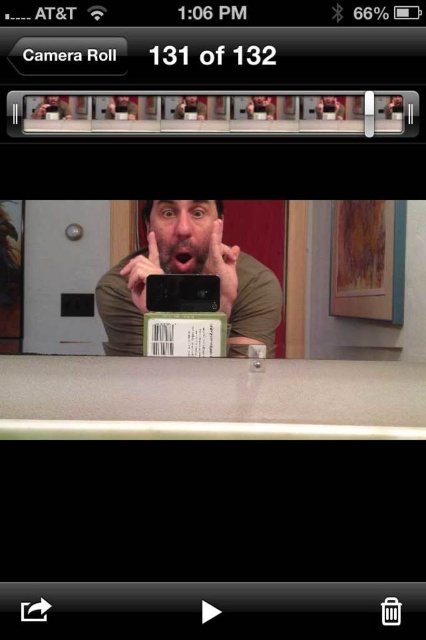
Question: Which of the following is the farthest from the observer?

Choices:
 (A) matte black phone at center
 (B) black matte smartphone at center

Answer: (B)

Question: Is matte black phone at center to the left of black matte smartphone at center from the viewer's perspective?

Choices:
 (A) yes
 (B) no

Answer: (B)

Question: Can you confirm if matte black phone at center is bigger than black matte smartphone at center?

Choices:
 (A) yes
 (B) no

Answer: (A)

Question: Is matte black phone at center thinner than black matte smartphone at center?

Choices:
 (A) no
 (B) yes

Answer: (A)

Question: Which point is farther to the camera?

Choices:
 (A) (207, 289)
 (B) (271, 308)

Answer: (A)

Question: Which of the following is the farthest from the observer?

Choices:
 (A) (155, 305)
 (B) (245, 264)

Answer: (A)